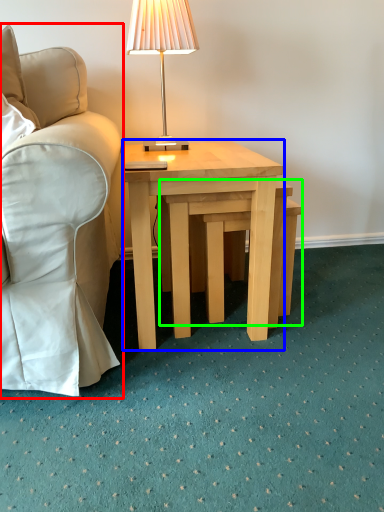
Question: Which object is positioned closest to chair (highlighted by a red box)? Select from coffee table (highlighted by a blue box) and step stool (highlighted by a green box).

Choices:
 (A) coffee table
 (B) step stool

Answer: (A)